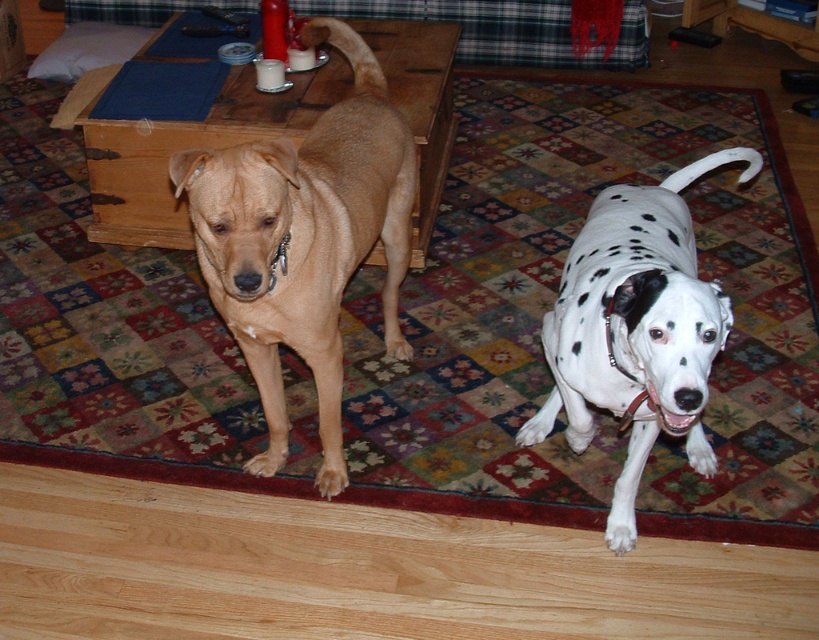
You are a dog trainer observing two dogs on a rug. You see the light brown fur at center and the matte tan dog at center. Which dog is positioned to the left?

The matte tan dog at center is positioned to the left of the light brown fur at center.